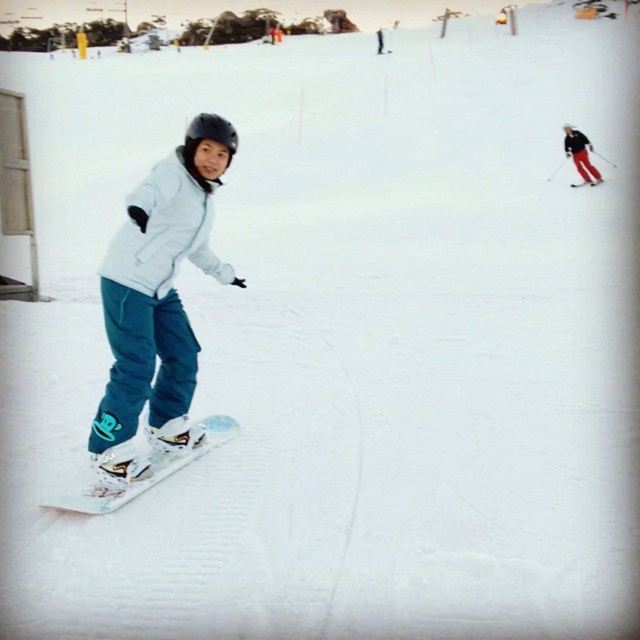
Question: Which object is the closest to the matte red ski pants at right?

Choices:
 (A) white glossy snowboard at lower left
 (B) teal matte snow pants at left

Answer: (A)

Question: In this image, where is teal matte snow pants at left located relative to matte red ski pants at right?

Choices:
 (A) right
 (B) left

Answer: (B)

Question: Considering the real-world distances, which object is farthest from the white glossy snowboard at lower left?

Choices:
 (A) matte red ski pants at right
 (B) teal matte snow pants at left

Answer: (A)

Question: Which of these objects is positioned closest to the teal matte snow pants at left?

Choices:
 (A) white glossy snowboard at lower left
 (B) matte red ski pants at right

Answer: (A)

Question: Can you confirm if white glossy snowboard at lower left is positioned above matte red ski pants at right?

Choices:
 (A) no
 (B) yes

Answer: (A)

Question: Considering the relative positions of teal matte snow pants at left and white glossy snowboard at lower left in the image provided, where is teal matte snow pants at left located with respect to white glossy snowboard at lower left?

Choices:
 (A) below
 (B) above

Answer: (B)